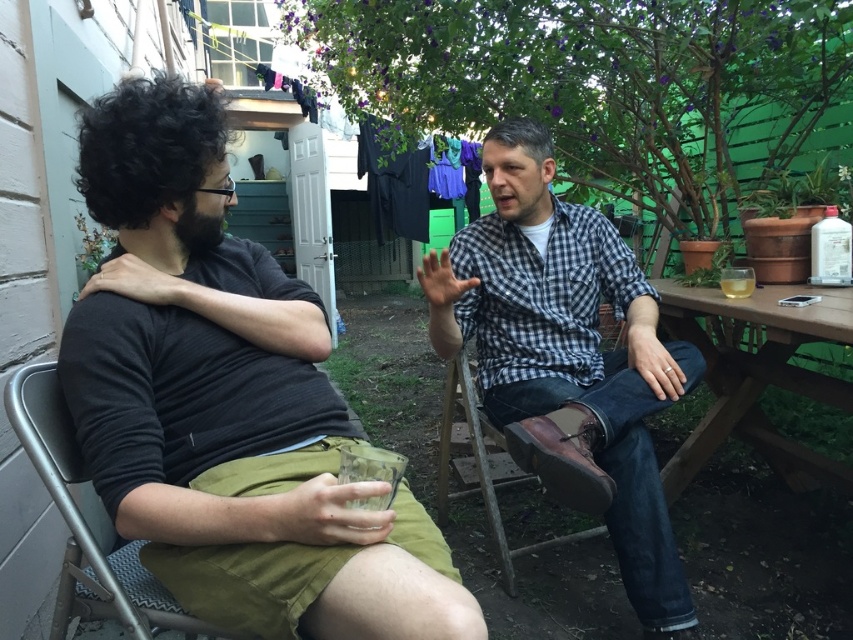
Is wooden picnic table at right smaller than brown leather chair at center?

No, wooden picnic table at right is not smaller than brown leather chair at center.

Between wooden picnic table at right and brown leather chair at center, which one is positioned lower?

Positioned lower is brown leather chair at center.

Measure the distance between wooden picnic table at right and camera.

37.67 inches

Find the location of a particular element. The image size is (853, 640). wooden picnic table at right is located at coordinates [757, 376].

Does metallic gray chair at left have a smaller size compared to brown leather chair at center?

Indeed, metallic gray chair at left has a smaller size compared to brown leather chair at center.

Which is behind, point (7, 392) or point (555, 538)?

The point (555, 538) is more distant.

Where is `metallic gray chair at left`? metallic gray chair at left is located at coordinates (86, 524).

Who is more forward, [225,209] or [488,296]?

Point [225,209] is more forward.

Can you confirm if dark gray t-shirt at left is positioned to the left of checkered fabric shirt at center?

Yes, dark gray t-shirt at left is to the left of checkered fabric shirt at center.

The image size is (853, 640). I want to click on dark gray t-shirt at left, so click(x=229, y=404).